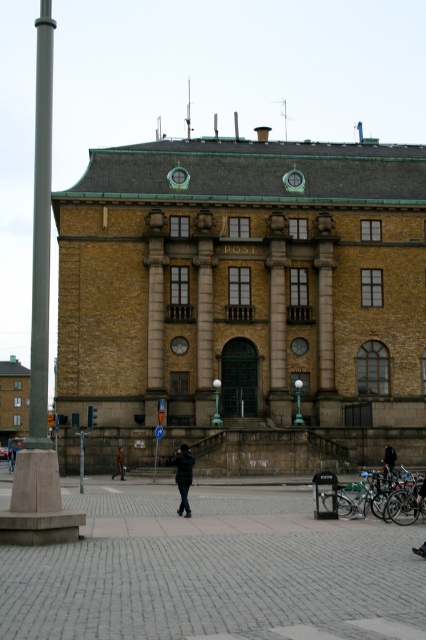
How much distance is there between black leather jacket at center and green glass lamp post at center?

31.96 feet

Can you confirm if black leather jacket at center is positioned below green glass lamp post at center?

Yes, black leather jacket at center is below green glass lamp post at center.

Does point (393, 458) come behind point (294, 416)?

No.

The image size is (426, 640). I want to click on black leather jacket at center, so click(x=388, y=460).

The width and height of the screenshot is (426, 640). What are the coordinates of `dark blue jacket at center` in the screenshot? It's located at (184, 476).

Who is more distant from viewer, [178,474] or [11,470]?

The point [11,470] is behind.

Is point (187, 460) positioned behind point (14, 460)?

No, it is in front of (14, 460).

Where is `dark blue jacket at center`? dark blue jacket at center is located at coordinates (184, 476).

Who is higher up, brown leather jacket at center or black leather jacket at lower center?

brown leather jacket at center is above.

Is brown leather jacket at center to the right of black leather jacket at lower center from the viewer's perspective?

Indeed, brown leather jacket at center is positioned on the right side of black leather jacket at lower center.

Which is behind, point (118, 460) or point (13, 465)?

The point (13, 465) is more distant.

The height and width of the screenshot is (640, 426). Identify the location of brown leather jacket at center. (120, 465).